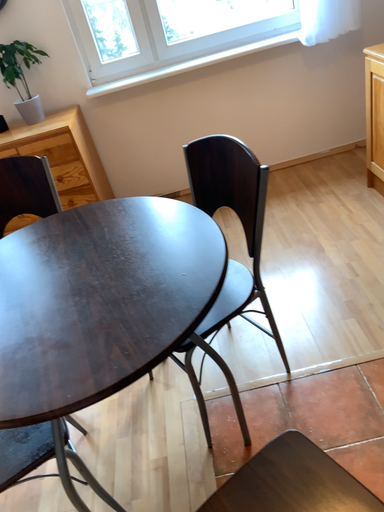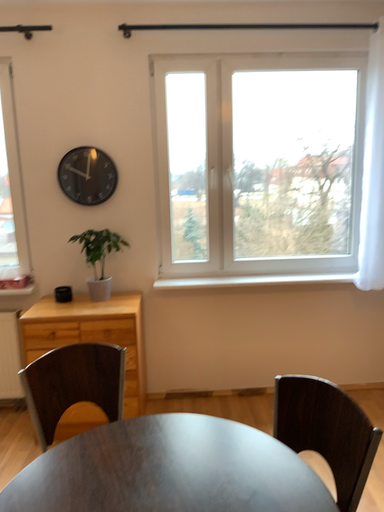
Question: Which way did the camera rotate in the video?

Choices:
 (A) rotated downward
 (B) rotated upward

Answer: (B)